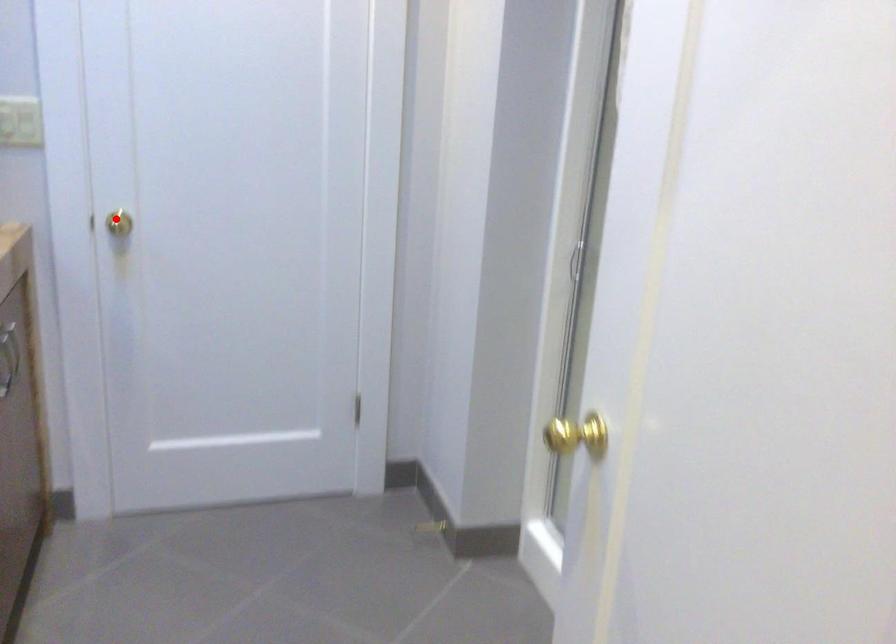
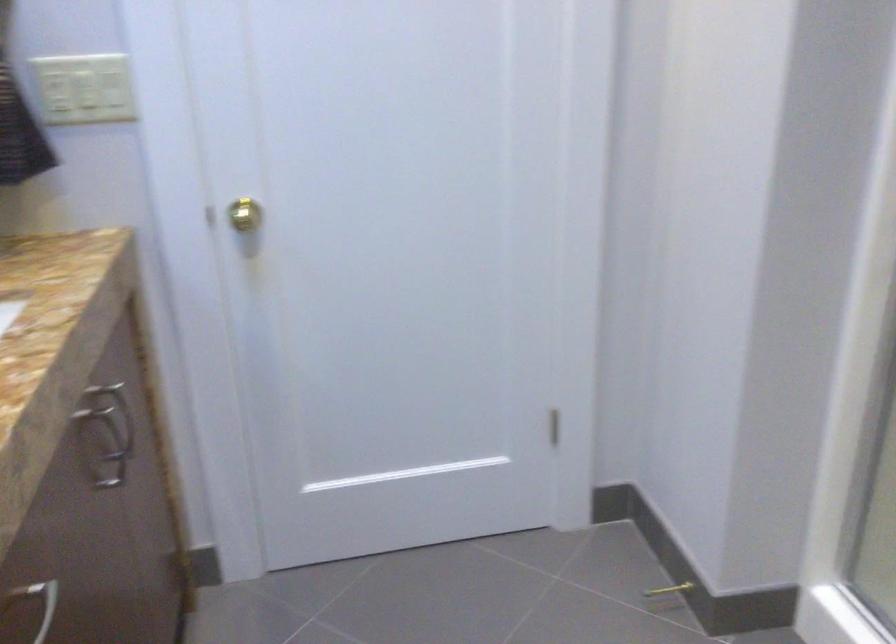
Question: I am providing you with two images of the same scene from different viewpoints. Image1 has a red point marked. In image2, the corresponding 3D location appears at what relative position? Reply with the corresponding letter.

Choices:
 (A) Closer
 (B) Farther

Answer: (A)